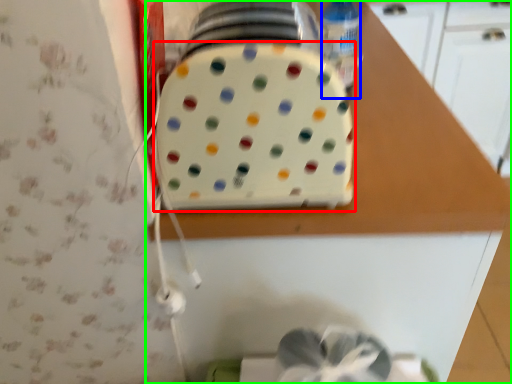
Question: Considering the real-world distances, which object is farthest from toaster (highlighted by a red box)? bottle (highlighted by a blue box) or countertop (highlighted by a green box)?

Choices:
 (A) bottle
 (B) countertop

Answer: (A)